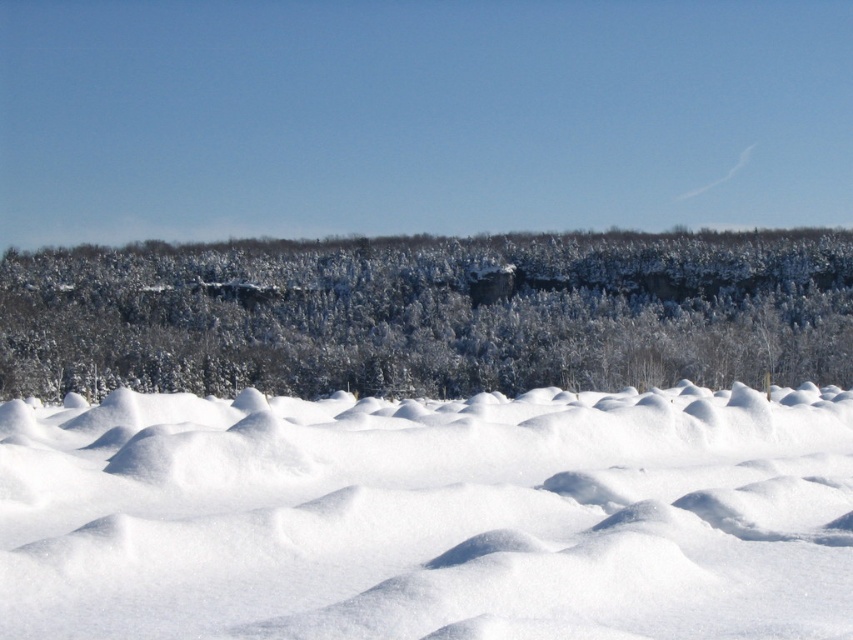
You are standing at the origin point of the coordinate system. You want to move to the white fluffy snow at center. Which direction should you move in terms of x and y coordinates?

The white fluffy snow at center is located at point 0.808 in the x direction and 0.504 in the y direction. So you should move towards increasing x and y coordinates to reach it.